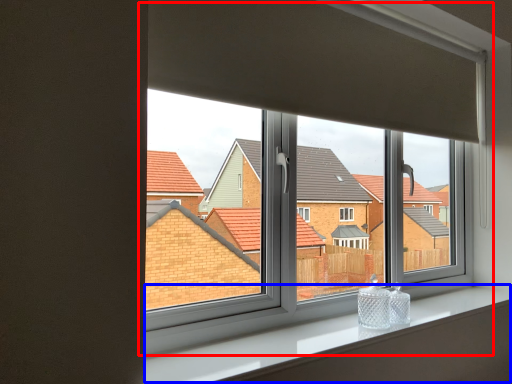
Question: Which of the following is the closest to the observer, window (highlighted by a red box) or window sill (highlighted by a blue box)?

Choices:
 (A) window
 (B) window sill

Answer: (B)